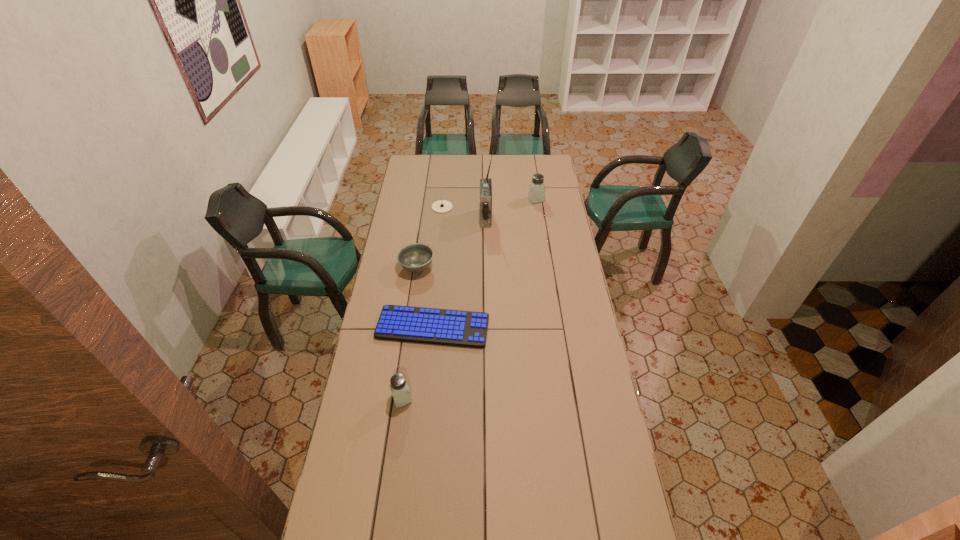
If equal spacing is desired by inserting an extra saltshaker among them, please point out a free spot for this new saltshaker. Please provide its 2D coordinates. Your answer should be formatted as a tuple, i.e. [(x, y)], where the tuple contains the x and y coordinates of a point satisfying the conditions above.

[(483, 278)]